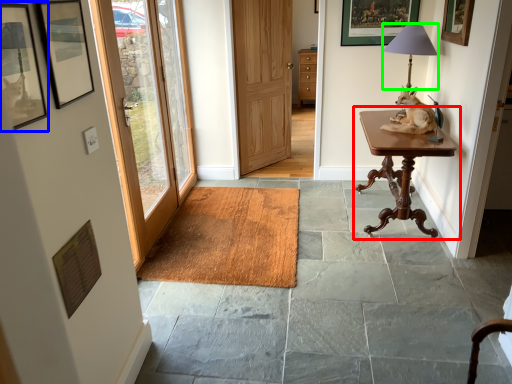
Question: Considering the real-world distances, which object is closest to table (highlighted by a red box)? picture frame (highlighted by a blue box) or table lamp (highlighted by a green box).

Choices:
 (A) picture frame
 (B) table lamp

Answer: (B)